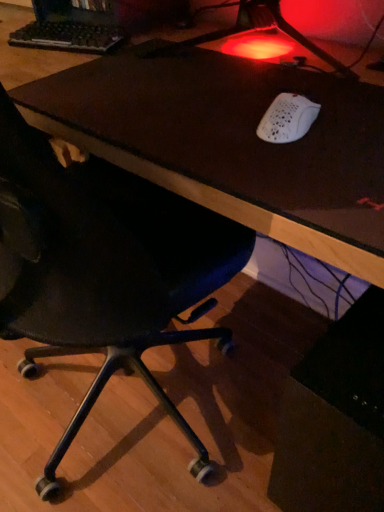
Question: Should I look upward or downward to see brown leather desk at center?

Choices:
 (A) down
 (B) up

Answer: (B)

Question: From a real-world perspective, is white matte mouse at upper right below brown leather desk at center?

Choices:
 (A) yes
 (B) no

Answer: (B)

Question: From the image's perspective, is white matte mouse at upper right on brown leather desk at center?

Choices:
 (A) yes
 (B) no

Answer: (B)

Question: Could you tell me if white matte mouse at upper right is turned towards brown leather desk at center?

Choices:
 (A) no
 (B) yes

Answer: (A)

Question: Is white matte mouse at upper right located outside brown leather desk at center?

Choices:
 (A) yes
 (B) no

Answer: (A)

Question: Does white matte mouse at upper right appear on the left side of brown leather desk at center?

Choices:
 (A) yes
 (B) no

Answer: (B)

Question: Does white matte mouse at upper right have a greater height compared to brown leather desk at center?

Choices:
 (A) no
 (B) yes

Answer: (A)

Question: Considering the relative positions of black plastic keyboard at upper left and brown leather desk at center in the image provided, is black plastic keyboard at upper left to the right of brown leather desk at center from the viewer's perspective?

Choices:
 (A) yes
 (B) no

Answer: (B)

Question: Is black plastic keyboard at upper left thinner than brown leather desk at center?

Choices:
 (A) yes
 (B) no

Answer: (A)

Question: Are black plastic keyboard at upper left and brown leather desk at center making contact?

Choices:
 (A) yes
 (B) no

Answer: (B)

Question: From a real-world perspective, does black plastic keyboard at upper left stand above brown leather desk at center?

Choices:
 (A) yes
 (B) no

Answer: (A)

Question: Is there a large distance between black plastic keyboard at upper left and brown leather desk at center?

Choices:
 (A) yes
 (B) no

Answer: (B)

Question: Is black plastic keyboard at upper left to the left of brown leather desk at center from the viewer's perspective?

Choices:
 (A) no
 (B) yes

Answer: (B)

Question: From the image's perspective, is brown leather desk at center on black plastic keyboard at upper left?

Choices:
 (A) yes
 (B) no

Answer: (B)